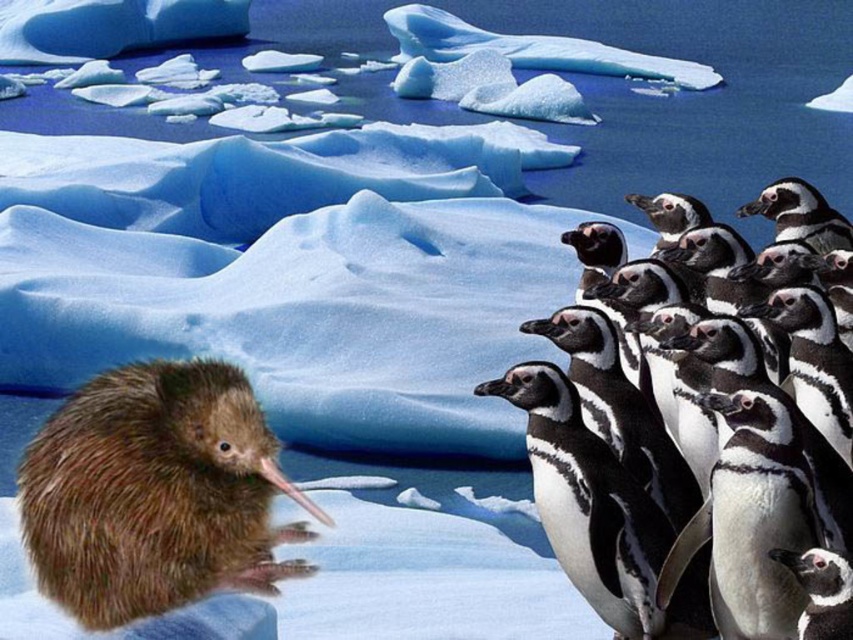
You are a birdwatcher observing the scene. You notice the brown fuzzy kiwi at lower left and the black and white feathers at right. Which of these two birds is positioned closer to the left side of the image?

The brown fuzzy kiwi at lower left is positioned closer to the left side of the image than the black and white feathers at right.